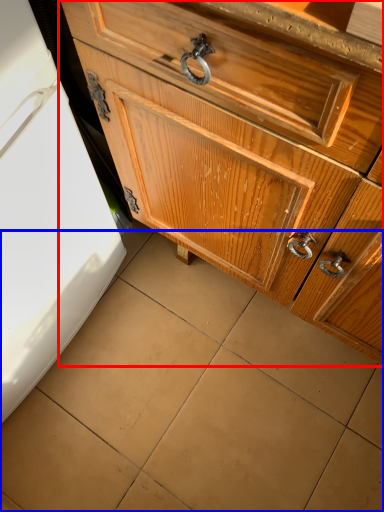
Question: Which object is further to the camera taking this photo, chest of drawers (highlighted by a red box) or tile (highlighted by a blue box)?

Choices:
 (A) chest of drawers
 (B) tile

Answer: (B)